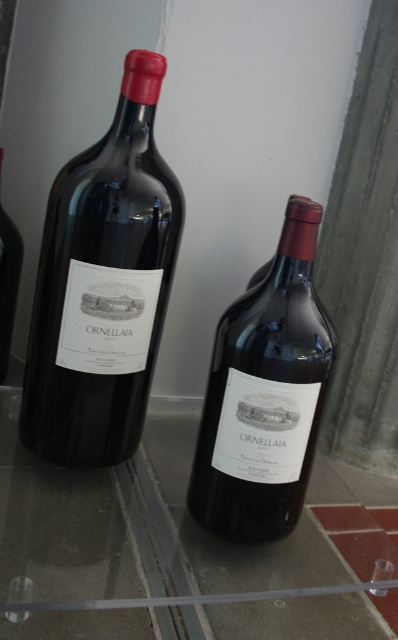
Question: Can you confirm if transparent glass table at center is bigger than matte glass bottle at left?

Choices:
 (A) no
 (B) yes

Answer: (B)

Question: Which object appears closest to the camera in this image?

Choices:
 (A) transparent glass table at center
 (B) matte glass bottle at left

Answer: (A)

Question: Which object is farther from the camera taking this photo?

Choices:
 (A) matte black wine at left
 (B) matte glass bottle at left
 (C) matte glass bottle at center

Answer: (B)

Question: Does matte black wine at left have a greater width compared to matte glass bottle at left?

Choices:
 (A) no
 (B) yes

Answer: (B)

Question: Among these points, which one is farthest from the camera?

Choices:
 (A) pyautogui.click(x=1, y=305)
 (B) pyautogui.click(x=267, y=356)
 (C) pyautogui.click(x=161, y=292)
 (D) pyautogui.click(x=202, y=589)

Answer: (A)

Question: Can you confirm if transparent glass table at center is positioned to the left of matte glass bottle at center?

Choices:
 (A) yes
 (B) no

Answer: (A)